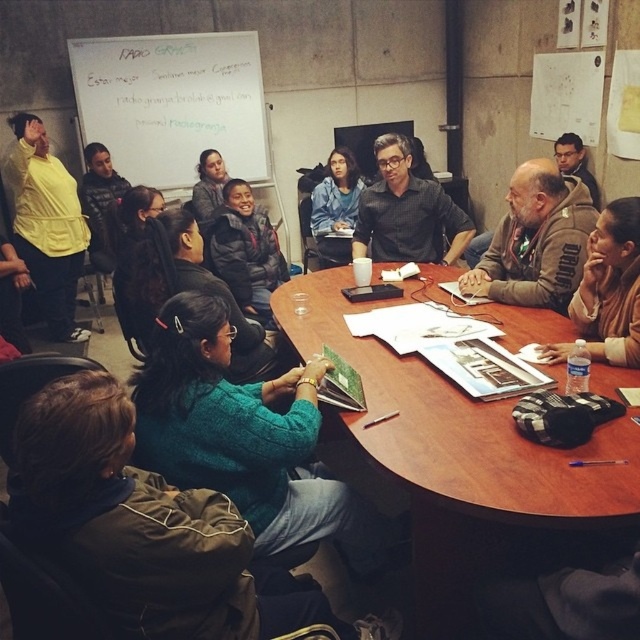
Can you confirm if teal sweater at center is positioned below black matte shirt at center?

Yes.

Between point (88, 545) and point (452, 250), which one is positioned in front?

Point (88, 545) is in front.

The height and width of the screenshot is (640, 640). In order to click on teal sweater at center in this screenshot , I will do `click(150, 529)`.

In order to click on teal sweater at center in this screenshot , I will do (150, 529).

Between wooden table at center and matte blue sweater at center, which one appears on the left side from the viewer's perspective?

matte blue sweater at center is more to the left.

Locate an element on the screen. wooden table at center is located at coordinates (461, 461).

You are a GUI agent. You are given a task and a screenshot of the screen. Output one action in this format:
    pyautogui.click(x=<x>, y=<y>)
    Task: Click on the wooden table at center
    
    Given the screenshot: What is the action you would take?
    pyautogui.click(x=461, y=461)

Locate an element on the screen. This screenshot has width=640, height=640. wooden table at center is located at coordinates (461, 461).

Identify the location of wooden table at center. (461, 461).

Which is above, wooden table at center or teal sweater at center?

wooden table at center is above.

What do you see at coordinates (461, 461) in the screenshot?
I see `wooden table at center` at bounding box center [461, 461].

Where is `wooden table at center`? The image size is (640, 640). wooden table at center is located at coordinates (461, 461).